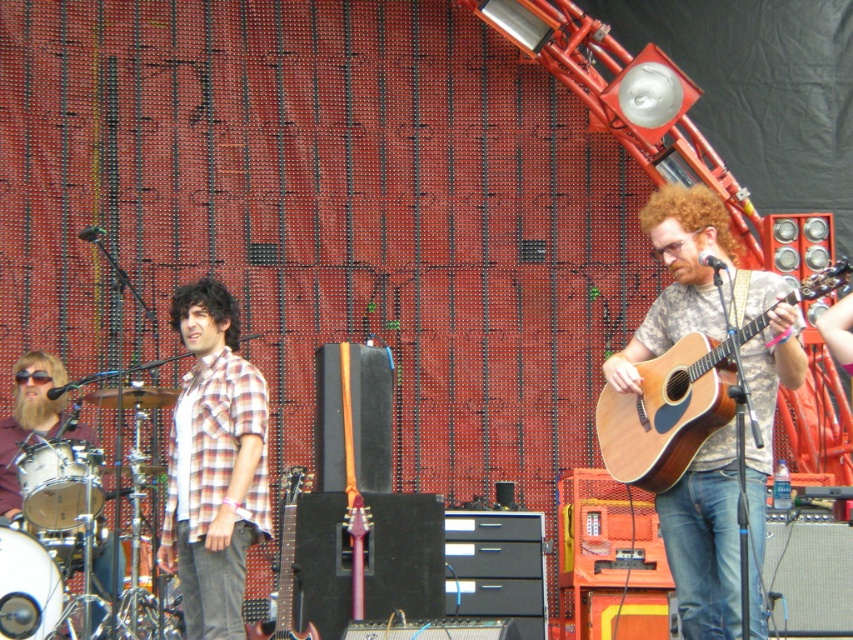
You are a stagehand preparing to move the wooden acoustic guitar at right and the natural wood acoustic guitar at right offstage. Which guitar should you move first if you need to place the taller one into a storage rack that requires it to be placed before the shorter one?

The wooden acoustic guitar at right is taller than the natural wood acoustic guitar at right, so you should move the wooden acoustic guitar at right first to ensure proper placement in the storage rack.

You are a stagehand standing at the edge of the stage. You need to hand the wooden acoustic guitar at right to the lead singer who is standing 10 meters away from you. Can you reach the singer by extending your arm? Assume your arm can reach up to 1.2 meters when fully extended.

The wooden acoustic guitar at right is 9.55 meters away from the viewer. Since the singer is 10 meters away and your arm can only extend 1.2 meters, you cannot reach them directly. You might need to ask someone closer to assist or use another method to pass the guitar.

Consider the image. You are a stagehand setting up for a concert. You need to place a new microphone stand between the wooden acoustic guitar at right and the natural wood acoustic guitar at right. Based on their positions, which guitar should the microphone stand be placed closer to?

The microphone stand should be placed closer to the wooden acoustic guitar at right because it is positioned below the natural wood acoustic guitar at right, meaning it is lower and likely closer to the ground, making it a better spot for the microphone stand.